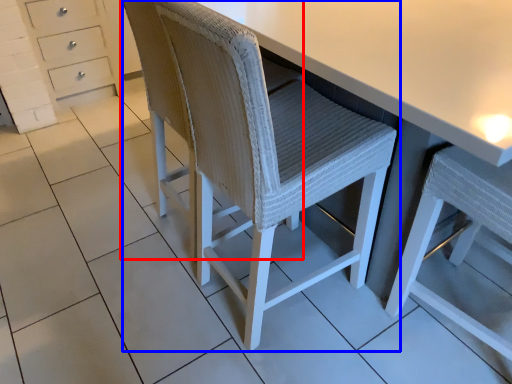
Question: Which of the following is the closest to the observer, swivel chair (highlighted by a red box) or chair (highlighted by a blue box)?

Choices:
 (A) swivel chair
 (B) chair

Answer: (B)